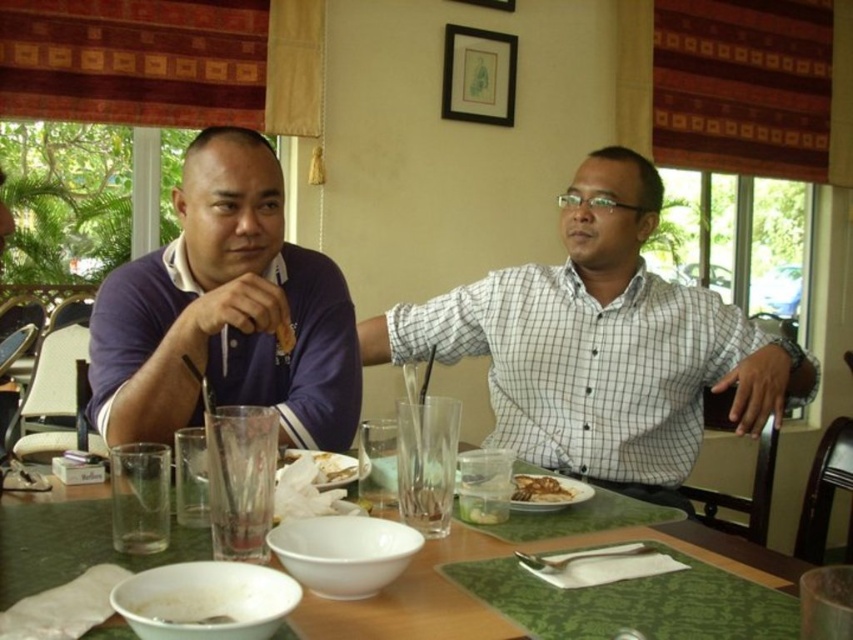
Question: Is the position of green textured table at center more distant than that of white matte bowl at lower left?

Choices:
 (A) no
 (B) yes

Answer: (B)

Question: Which of the following is the closest to the observer?

Choices:
 (A) brown matte plate at center
 (B) green textured table at center

Answer: (B)

Question: Which point appears farthest from the camera in this image?

Choices:
 (A) (584, 536)
 (B) (173, 259)
 (C) (351, 477)
 (D) (521, 497)

Answer: (B)

Question: Which point is closer to the camera?

Choices:
 (A) (395, 333)
 (B) (254, 630)

Answer: (B)

Question: Can you confirm if white checkered shirt at center is positioned to the left of green textured table at center?

Choices:
 (A) yes
 (B) no

Answer: (B)

Question: Does white matte bowl at lower left come in front of white paper napkin at center?

Choices:
 (A) no
 (B) yes

Answer: (B)